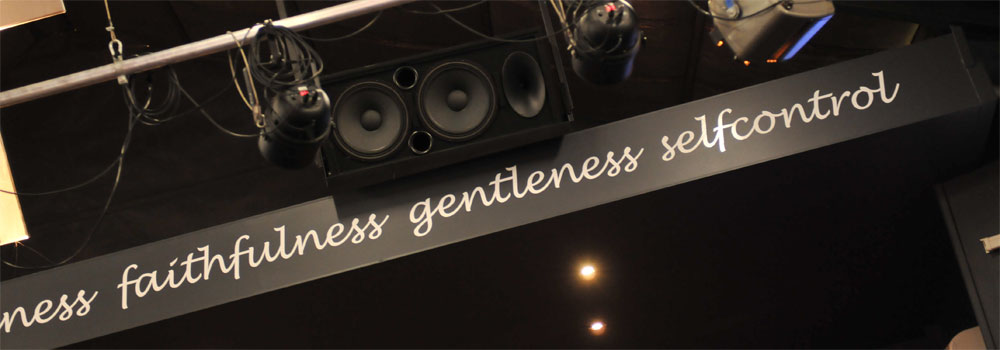
Identify the location of speaker. (377, 107), (464, 107).